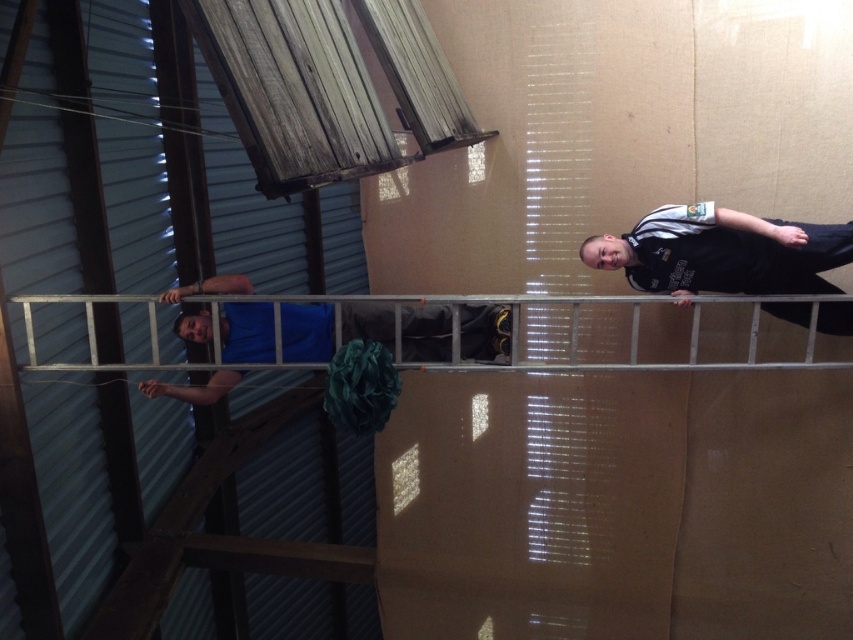
Question: Is black jersey at right to the left of silver metallic ladder at center from the viewer's perspective?

Choices:
 (A) no
 (B) yes

Answer: (A)

Question: Which of the following is the closest to the observer?

Choices:
 (A) black jersey at right
 (B) blue fabric at center

Answer: (B)

Question: Does black jersey at right appear on the left side of blue fabric at center?

Choices:
 (A) yes
 (B) no

Answer: (B)

Question: Which point is farther to the camera?

Choices:
 (A) (230, 388)
 (B) (212, 364)
 (C) (666, 212)

Answer: (A)

Question: Observing the image, what is the correct spatial positioning of black jersey at right in reference to blue fabric at center?

Choices:
 (A) left
 (B) right

Answer: (B)

Question: Among these objects, which one is nearest to the camera?

Choices:
 (A) silver metallic ladder at center
 (B) black jersey at right
 (C) blue fabric at center

Answer: (C)